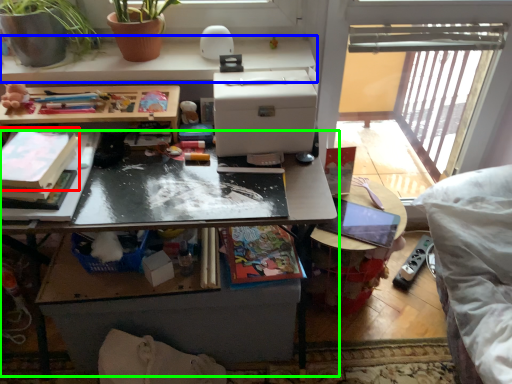
Question: Considering the real-world distances, which object is farthest from book (highlighted by a red box)? desk (highlighted by a blue box) or table (highlighted by a green box)?

Choices:
 (A) desk
 (B) table

Answer: (A)